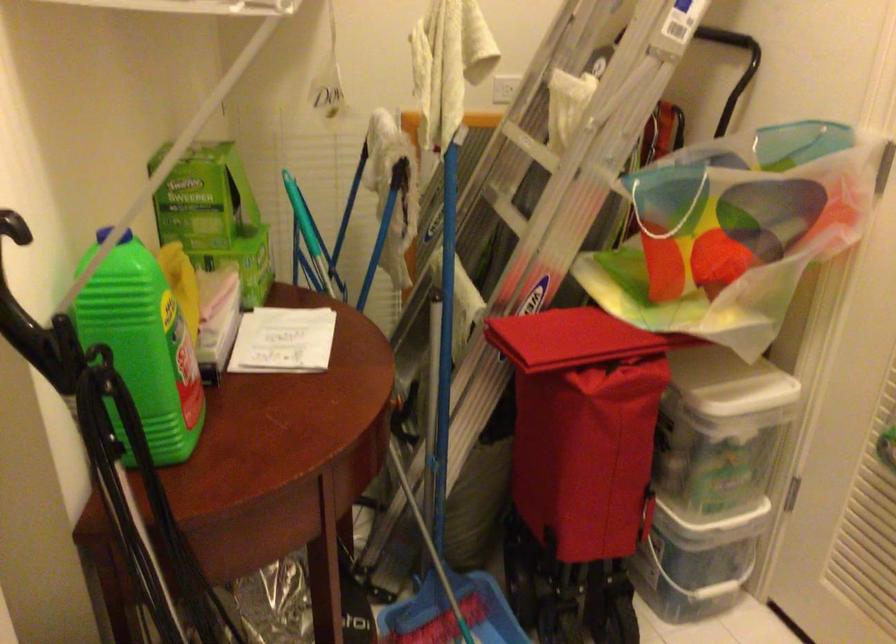
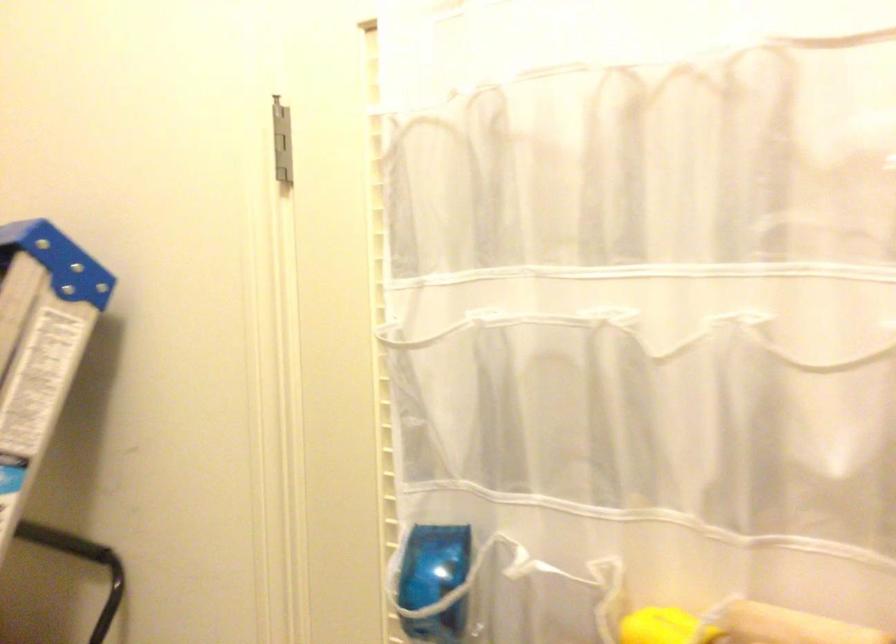
The first image is from the beginning of the video and the second image is from the end. How did the camera likely rotate when shooting the video?

The camera's rotation is toward right-up.